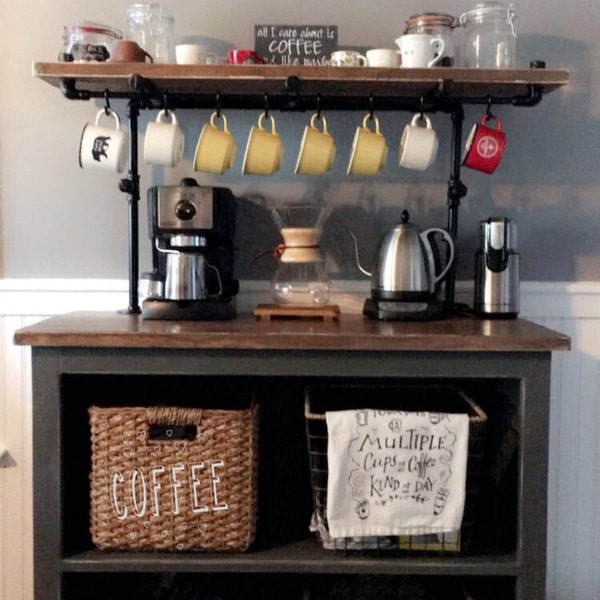
Locate an element on the screen. This screenshot has height=600, width=600. glass container jar is located at coordinates (482, 37), (155, 35).